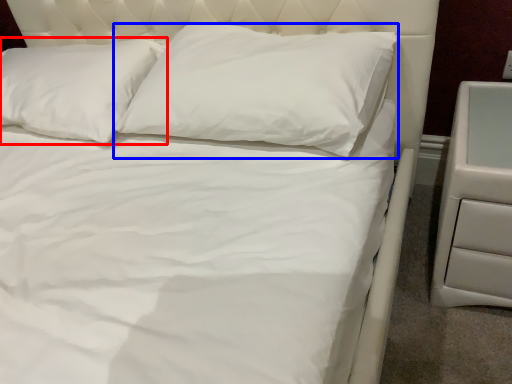
Question: Among these objects, which one is farthest to the camera, pillow (highlighted by a red box) or pillow (highlighted by a blue box)?

Choices:
 (A) pillow
 (B) pillow

Answer: (A)